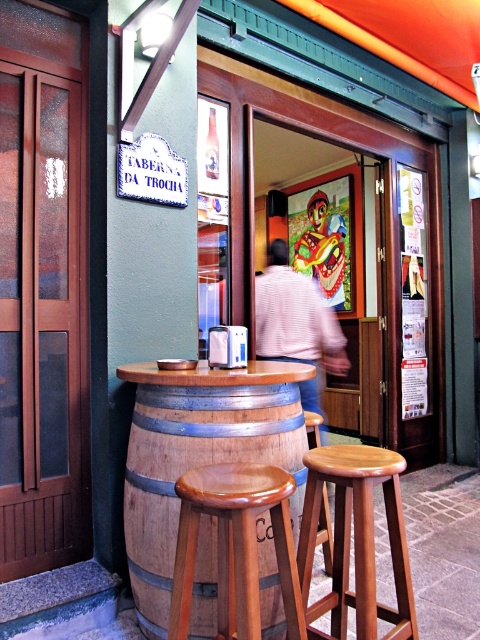
You are a delivery person who needs to place a new wooden bar stool at center and a translucent glass bottle at center on a small shelf. The shelf can only hold items that are smaller than 20 cm in height. Can both items fit on the shelf?

The wooden bar stool at center is bigger than the translucent glass bottle at center. Since the shelf can only hold items smaller than 20 cm in height, and the stool is larger, it likely exceeds the height limit. Therefore, only the translucent glass bottle at center can fit on the shelf.

You are a delivery person carrying a package that requires placing it exactly between the wooden barrel at center and the matte plastic mask at center. Given the distance between them, can you safely place the package without it being too close to either object?

The distance between the wooden barrel at center and the matte plastic mask at center is 3.89 meters. To place the package exactly in the middle, it would need to be positioned 1.945 meters away from each object. Since this distance is sufficient, the package can be safely placed without being too close to either object.

You are a customer at the Taberna da Trocha and want to place a matte plastic mask at center on top of the wooden barrel at center. Will the mask fit on the barrel without falling off?

The wooden barrel at center is not as tall as matte plastic mask at center, so the mask might not fit securely on top of the barrel and could potentially fall off.